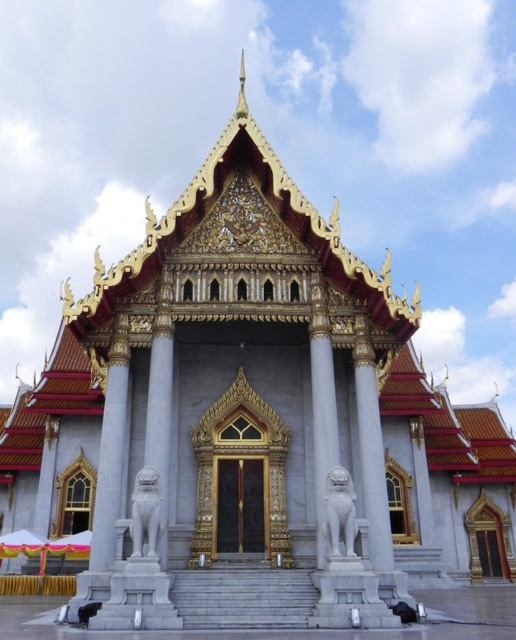
Is white marble lion at center to the right of white marble lion at lower center from the viewer's perspective?

Correct, you'll find white marble lion at center to the right of white marble lion at lower center.

Is white marble lion at center further to the viewer compared to white marble lion at lower center?

That is True.

Does point (330, 461) come behind point (163, 406)?

No, it is not.

The image size is (516, 640). I want to click on white marble lion at center, so click(322, 419).